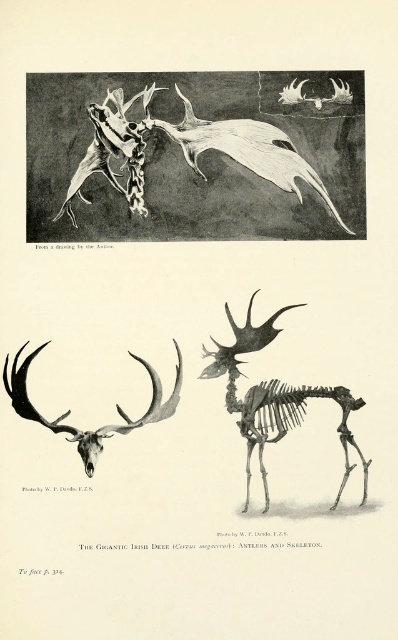
You are an archaeologist examining the image of the deer skeletal remains. You notice a point marked at coordinates (187, 150). What object is located at this point?

The point at coordinates (187, 150) is where the bone like antlers at upper center are located.